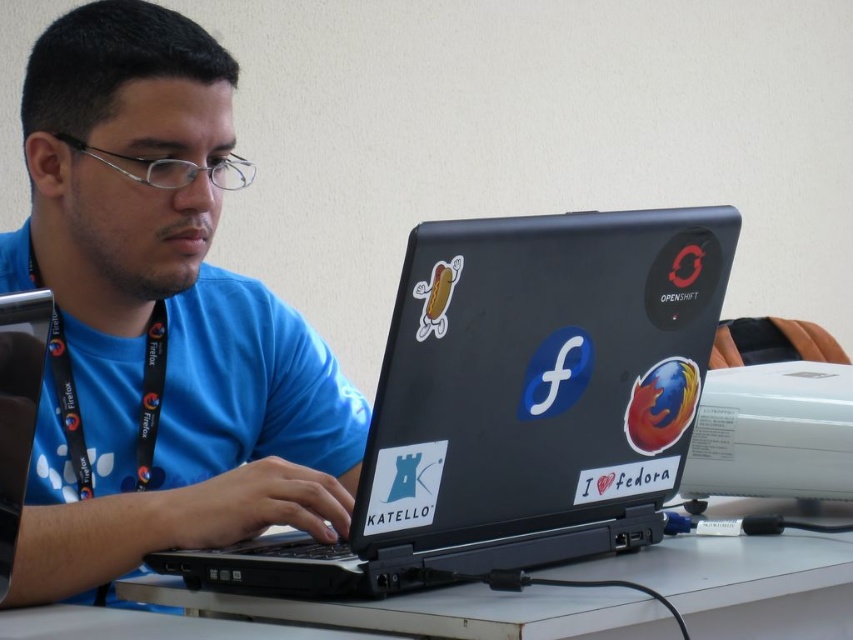
Question: Which of these objects is positioned farthest from the black matte laptop at center?

Choices:
 (A) blue fabric shirt at center
 (B) black fabric lanyard at left
 (C) white plastic table at center

Answer: (B)

Question: Among these points, which one is nearest to the camera?

Choices:
 (A) (648, 227)
 (B) (151, 344)
 (C) (822, 518)

Answer: (A)

Question: Which object appears closest to the camera in this image?

Choices:
 (A) black fabric lanyard at left
 (B) black matte laptop at center

Answer: (B)

Question: Does blue fabric shirt at center have a larger size compared to white plastic table at center?

Choices:
 (A) no
 (B) yes

Answer: (B)

Question: Can you confirm if blue fabric shirt at center is positioned below black fabric lanyard at left?

Choices:
 (A) yes
 (B) no

Answer: (B)

Question: Can you confirm if white plastic table at center is smaller than black fabric lanyard at left?

Choices:
 (A) yes
 (B) no

Answer: (B)